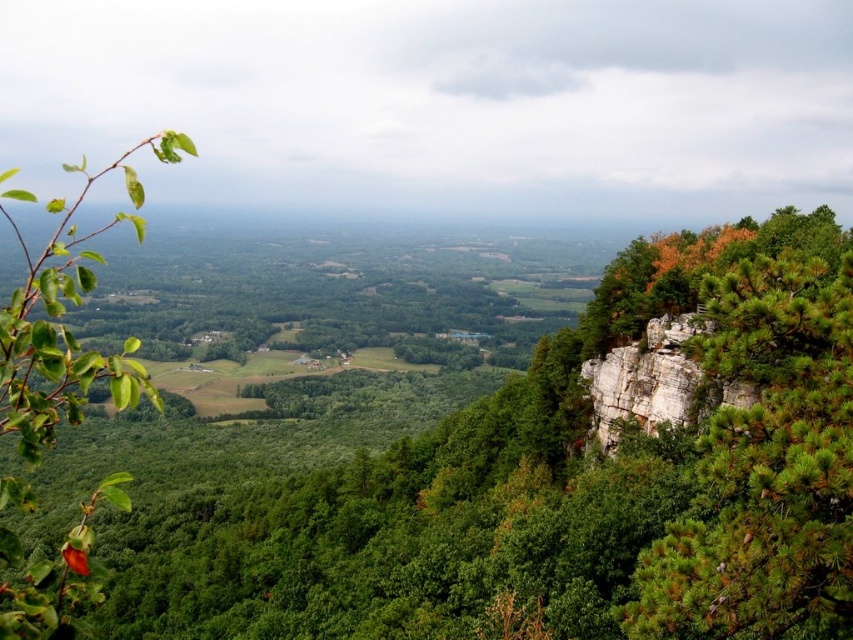
Question: Does green pine tree at right have a smaller size compared to green matte leaf at left?

Choices:
 (A) yes
 (B) no

Answer: (A)

Question: Which of the following is the closest to the observer?

Choices:
 (A) green matte tree at upper left
 (B) green pine tree at right

Answer: (A)

Question: Which object is the closest to the green matte tree at upper left?

Choices:
 (A) green pine tree at right
 (B) green matte leaf at left

Answer: (A)

Question: Which object is closer to the camera taking this photo?

Choices:
 (A) green matte tree at upper left
 (B) green matte leaf at left
 (C) green pine tree at right

Answer: (B)

Question: In this image, where is green matte tree at upper left located relative to green matte leaf at left?

Choices:
 (A) above
 (B) below

Answer: (B)

Question: Does green matte tree at upper left have a larger size compared to green pine tree at right?

Choices:
 (A) yes
 (B) no

Answer: (A)